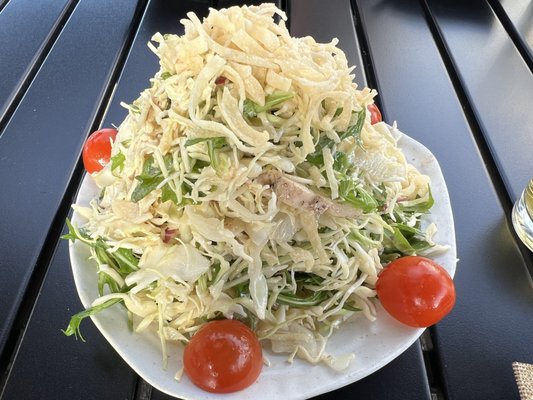
This screenshot has height=400, width=533. In order to click on edge of placemet in this screenshot , I will do `click(524, 378)`.